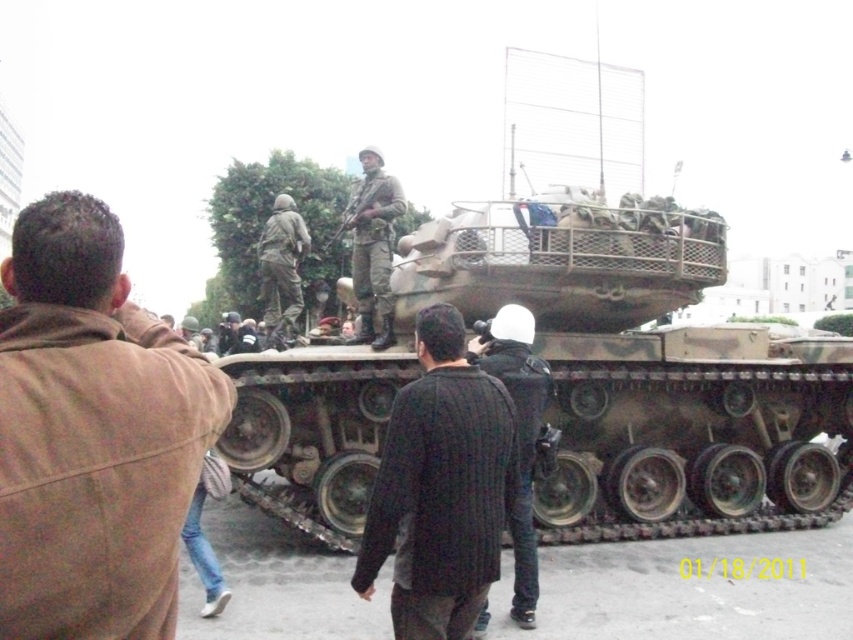
Question: Is black ribbed sweater at center closer to camera compared to dark gray sweater at center?

Choices:
 (A) no
 (B) yes

Answer: (B)

Question: Based on their relative distances, which object is nearer to the black ribbed sweater at center?

Choices:
 (A) camouflage fabric soldier at center
 (B) camouflage paint tank at center

Answer: (B)

Question: Which object is closer to the camera taking this photo?

Choices:
 (A) brown leather jacket at upper left
 (B) camouflage fabric uniform at center
 (C) black ribbed sweater at center

Answer: (A)

Question: Can you confirm if brown leather jacket at upper left is positioned above black ribbed sweater at center?

Choices:
 (A) yes
 (B) no

Answer: (A)

Question: Can you confirm if brown leather jacket at upper left is thinner than black ribbed sweater at center?

Choices:
 (A) no
 (B) yes

Answer: (B)

Question: Which of the following is the closest to the observer?

Choices:
 (A) dark gray sweater at center
 (B) camouflage paint tank at center
 (C) camouflage fabric uniform at center
 (D) black ribbed sweater at center

Answer: (D)